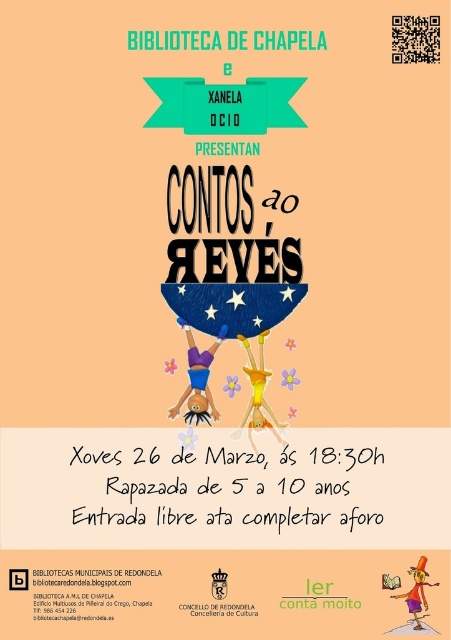
From the picture: You are designing a poster and need to place a decorative border around both the black paper text at center and the blacktexturedtext at center. Which text will require a smaller border in terms of height?

The black paper text at center is shorter than blacktexturedtext at center, so it will require a smaller border in terms of height.